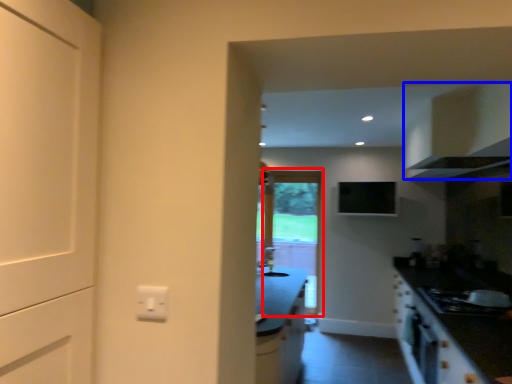
Question: Which of the following is the farthest to the observer, screen door (highlighted by a red box) or cabinetry (highlighted by a blue box)?

Choices:
 (A) screen door
 (B) cabinetry

Answer: (A)